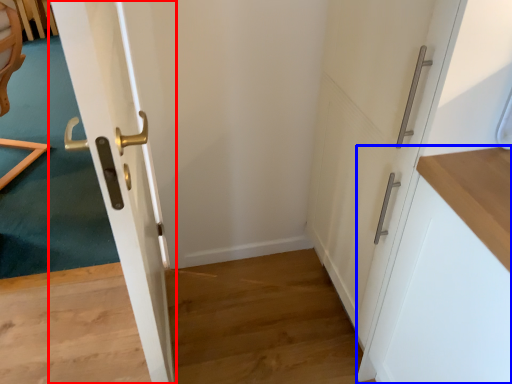
Question: Which point is further to the camera, door (highlighted by a red box) or cabinetry (highlighted by a blue box)?

Choices:
 (A) door
 (B) cabinetry

Answer: (B)